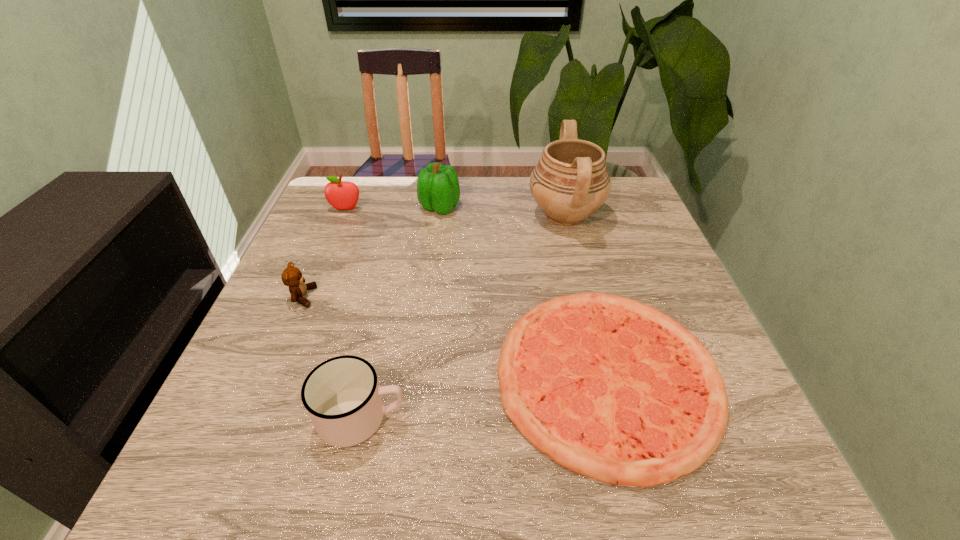
Find the location of a particular element. The image size is (960, 540). vacant area located on the right of the apple is located at coordinates (420, 210).

At what (x,y) coordinates should I click in order to perform the action: click on vacant space located on the side of the mug with the handle. Please return your answer as a coordinate pair (x, y). The height and width of the screenshot is (540, 960). Looking at the image, I should click on (442, 417).

Find the location of a particular element. free spot located on the front-facing side of the teddy bear is located at coordinates (396, 297).

This screenshot has width=960, height=540. I want to click on free space located on the left of the shortest object, so click(x=353, y=376).

At what (x,y) coordinates should I click in order to perform the action: click on urn that is at the far edge. Please return your answer as a coordinate pair (x, y). Looking at the image, I should click on (570, 182).

Locate an element on the screen. This screenshot has height=540, width=960. bell pepper located in the far edge section of the desktop is located at coordinates (438, 189).

Image resolution: width=960 pixels, height=540 pixels. I want to click on apple that is at the far edge, so point(342,195).

I want to click on mug that is at the near edge, so click(x=343, y=399).

You are a GUI agent. You are given a task and a screenshot of the screen. Output one action in this format:
    pyautogui.click(x=<x>, y=<y>)
    Task: Click on the pizza that is at the near edge
    The image size is (960, 540).
    Given the screenshot: What is the action you would take?
    pyautogui.click(x=610, y=388)

Find the location of a particular element. apple positioned at the left edge is located at coordinates (342, 195).